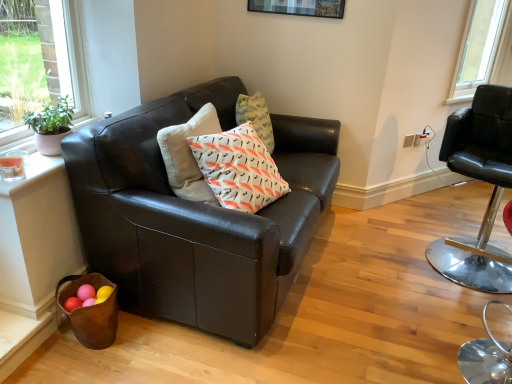
Question: From a real-world perspective, relative to matte black couch at center, is black leather chair at right vertically above or below?

Choices:
 (A) above
 (B) below

Answer: (A)

Question: From the image's perspective, is black leather chair at right positioned above or below matte black couch at center?

Choices:
 (A) above
 (B) below

Answer: (B)

Question: Choose the correct answer: Is black leather chair at right inside matte black couch at center or outside it?

Choices:
 (A) inside
 (B) outside

Answer: (B)

Question: Would you say matte black couch at center is to the left or to the right of black leather chair at right in the picture?

Choices:
 (A) right
 (B) left

Answer: (B)

Question: From their relative heights in the image, would you say matte black couch at center is taller or shorter than black leather chair at right?

Choices:
 (A) short
 (B) tall

Answer: (A)

Question: From the image's perspective, relative to black leather chair at right, is matte black couch at center above or below?

Choices:
 (A) below
 (B) above

Answer: (B)

Question: Considering the positions of matte black couch at center and black leather chair at right in the image, is matte black couch at center wider or thinner than black leather chair at right?

Choices:
 (A) wide
 (B) thin

Answer: (A)